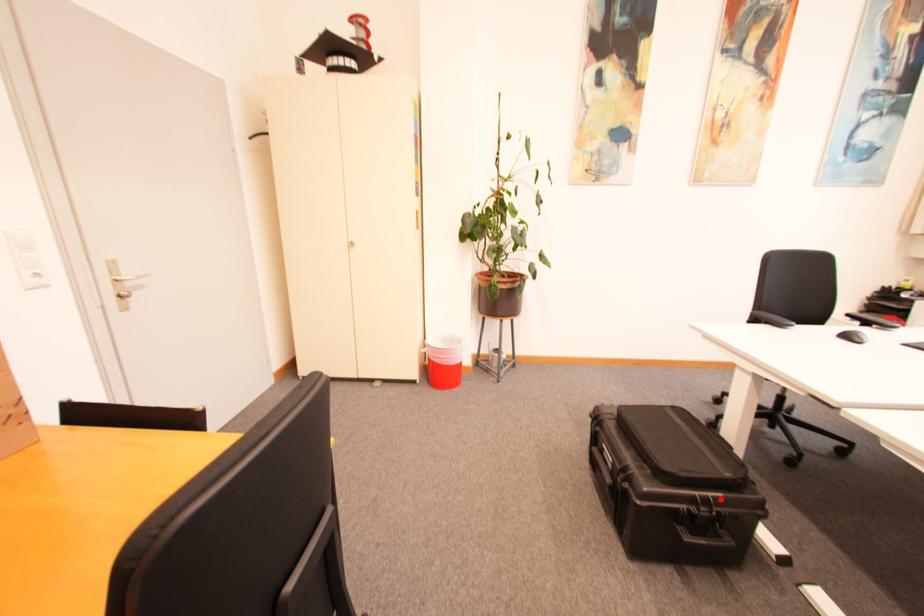
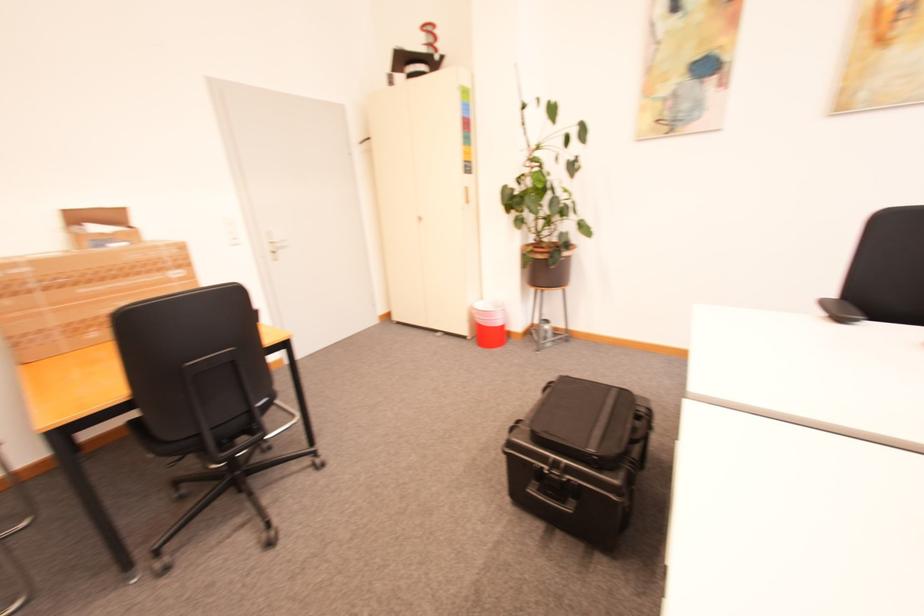
In the second image, find the point that corresponds to the highlighted location in the first image.

(574, 467)